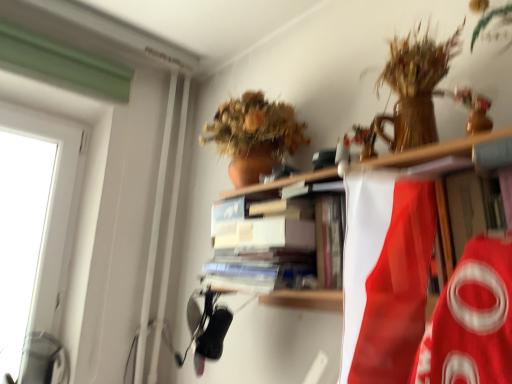
Question: Based on their positions, is wooden shelf at upper center located to the left or right of white cardboard book at center?

Choices:
 (A) left
 (B) right

Answer: (B)

Question: Looking at the image, does wooden shelf at upper center seem bigger or smaller compared to white cardboard book at center?

Choices:
 (A) big
 (B) small

Answer: (A)

Question: In terms of height, does wooden shelf at upper center look taller or shorter compared to white cardboard book at center?

Choices:
 (A) short
 (B) tall

Answer: (B)

Question: From the image's perspective, is white cardboard book at center positioned above or below wooden shelf at upper center?

Choices:
 (A) below
 (B) above

Answer: (B)

Question: In the image, is white cardboard book at center positioned in front of or behind wooden shelf at upper center?

Choices:
 (A) front
 (B) behind

Answer: (B)

Question: Which is correct: white cardboard book at center is inside wooden shelf at upper center, or outside of it?

Choices:
 (A) outside
 (B) inside

Answer: (B)

Question: Considering the positions of point (229, 256) and point (451, 256), is point (229, 256) closer or farther from the camera than point (451, 256)?

Choices:
 (A) farther
 (B) closer

Answer: (A)